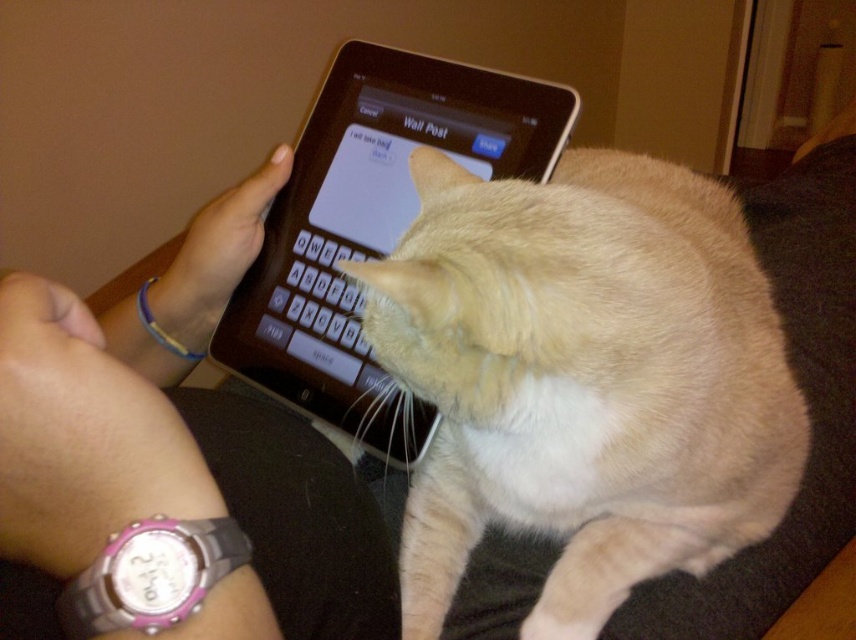
You are a delivery robot that needs to place a small package on the black glossy tablet at center without disturbing the light brown fur cat at center. Can you do this task?

The light brown fur cat at center is taller than the black glossy tablet at center. Since the cat is taller than the tablet, placing the package might require moving the cat first to avoid disturbing it, so it might not be possible without disturbing the cat.

You are a delivery robot trying to reach the tablet in the scene. The tablet is located at point 0.5 on the x and y axis. The light brown fur cat at center is blocking your path at point 0.594, 0.682. Can you navigate around the cat to reach the tablet?

The light brown fur cat at center is located at point (583, 380), which is slightly to the right and above the tablet at (428, 320). To navigate around the cat, the robot can move either to the left of the cat by going towards lower x coordinates or below the cat by moving to lower y coordinates, avoiding the cat at (583, 380).